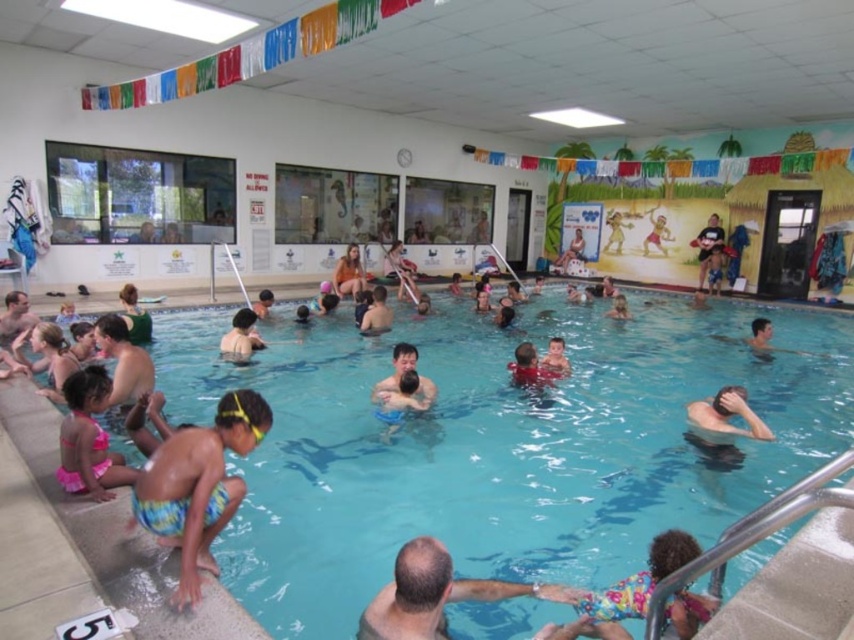
Who is taller, multicolored swimsuit at lower right or matte skin at center?

matte skin at center

Measure the distance from multicolored swimsuit at lower right to matte skin at center.

multicolored swimsuit at lower right and matte skin at center are 3.04 meters apart.

Find the location of a particular element. Image resolution: width=854 pixels, height=640 pixels. multicolored swimsuit at lower right is located at coordinates (629, 580).

Between smooth skin man at lower center and multicolored swimsuit at lower right, which one is positioned higher?

smooth skin man at lower center is higher up.

Between smooth skin man at lower center and multicolored swimsuit at lower right, which one is positioned lower?

multicolored swimsuit at lower right is lower down.

Is point (436, 611) farther from camera compared to point (581, 634)?

That is False.

Where is `smooth skin man at lower center`? The height and width of the screenshot is (640, 854). smooth skin man at lower center is located at coordinates (424, 595).

Is pink fabric swimsuit at lower left taller than matte skin at center?

Yes, pink fabric swimsuit at lower left is taller than matte skin at center.

Which of these two, pink fabric swimsuit at lower left or matte skin at center, stands shorter?

Standing shorter between the two is matte skin at center.

Describe the element at coordinates (89, 438) in the screenshot. The height and width of the screenshot is (640, 854). I see `pink fabric swimsuit at lower left` at that location.

Find the location of a particular element. This screenshot has width=854, height=640. pink fabric swimsuit at lower left is located at coordinates (89, 438).